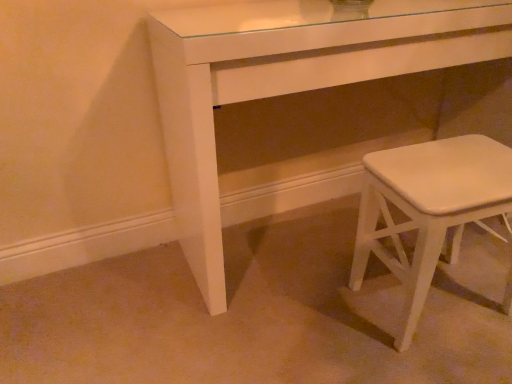
You are a GUI agent. You are given a task and a screenshot of the screen. Output one action in this format:
    pyautogui.click(x=<x>, y=<y>)
    Task: Click on the blank space situated above white matte stool at lower right (from a real-world perspective)
    
    Given the screenshot: What is the action you would take?
    pyautogui.click(x=453, y=163)